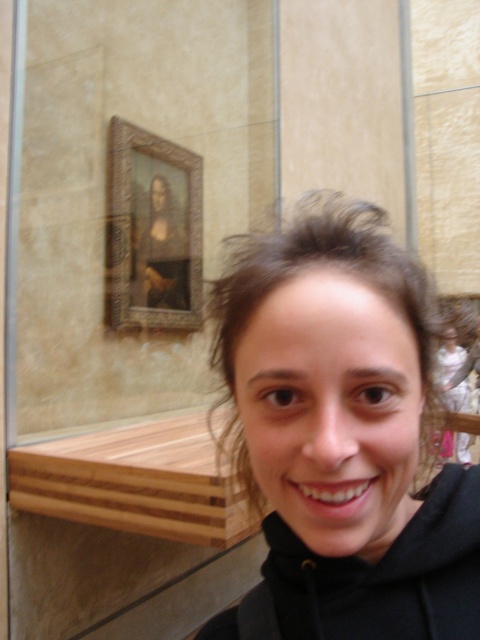
You are an interior designer planning to place a new sculpture in the museum. The sculpture requires a clear space of 1 meter in front of it. The sculpture must be placed such that it does not block the view of the Mona Lisa painting. Considering the location of the matte black hoodie at center, where should you position the sculpture to ensure it meets these requirements?

The matte black hoodie at center is located at point (342, 436). To place the sculpture 1 meter away from this position while keeping the view of the Mona Lisa unobstructed, position the sculpture in an area that maintains a clear path to the painting, ensuring the sculpture is not directly in front of the hoodie or blocking the line of sight to the artwork.